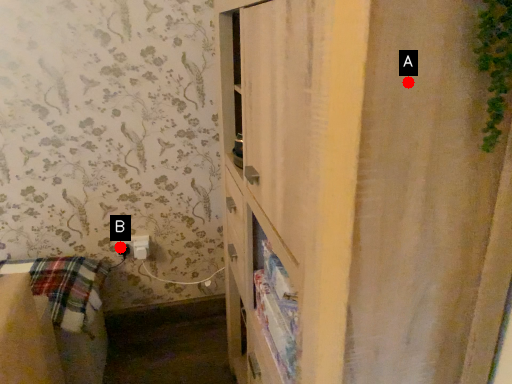
Question: Two points are circled on the image, labeled by A and B beside each circle. Which point is further to the camera?

Choices:
 (A) A is further
 (B) B is further

Answer: (B)